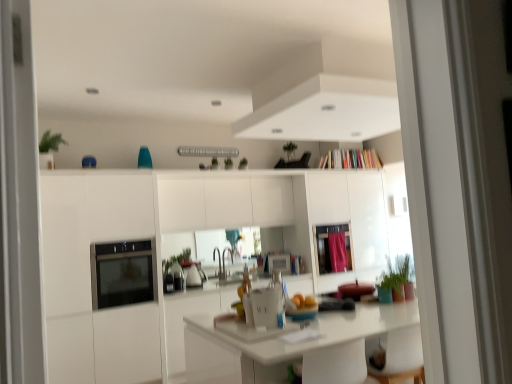
You are a GUI agent. You are given a task and a screenshot of the screen. Output one action in this format:
    pyautogui.click(x=<x>, y=<y>)
    Task: Click on the pink fabric screen door at center
    This screenshot has height=384, width=512.
    Given the screenshot: What is the action you would take?
    pyautogui.click(x=329, y=247)

This screenshot has width=512, height=384. What do you see at coordinates (337, 251) in the screenshot?
I see `pink fabric curtain at upper center` at bounding box center [337, 251].

At what (x,y) coordinates should I click in order to perform the action: click on pink fabric curtain at upper center. Please return your answer as a coordinate pair (x, y). The image size is (512, 384). Looking at the image, I should click on (337, 251).

In order to face green matte plant at lower right, placed as the 1th plant when sorted from front to back, should I rotate leftwards or rightwards?

To face it directly, rotate right by 19.188 degrees.

What do you see at coordinates (122, 273) in the screenshot? I see `black glass oven at lower left` at bounding box center [122, 273].

At what (x,y) coordinates should I click in order to perform the action: click on pink fabric screen door at center. Please return your answer as a coordinate pair (x, y). Looking at the image, I should click on (329, 247).

Considering the sizes of objects pink fabric curtain at upper center and pink fabric screen door at center in the image provided, who is taller, pink fabric curtain at upper center or pink fabric screen door at center?

pink fabric screen door at center.

Between pink fabric curtain at upper center and pink fabric screen door at center, which one has larger width?

Wider between the two is pink fabric screen door at center.

Which object is further away from the camera, pink fabric curtain at upper center or pink fabric screen door at center?

pink fabric curtain at upper center.

Does green matte plant at lower right, placed as the 1th plant when sorted from front to back, have a greater height compared to pink fabric screen door at center?

No, green matte plant at lower right, placed as the 1th plant when sorted from front to back, is not taller than pink fabric screen door at center.

Which is more to the left, green matte plant at lower right, which is the third plant in top-to-bottom order, or pink fabric screen door at center?

From the viewer's perspective, pink fabric screen door at center appears more on the left side.

Consider the image. From the image's perspective, which one is positioned higher, green matte plant at lower right, which ranks as the 3th plant in left-to-right order, or pink fabric screen door at center?

green matte plant at lower right, which ranks as the 3th plant in left-to-right order.

From the picture: Which is less distant, (x=412, y=288) or (x=346, y=260)?

Point (x=412, y=288) appears to be closer to the viewer than point (x=346, y=260).

Does white glossy microwave at center come behind pink fabric screen door at center?

Yes, white glossy microwave at center is further from the camera.

Does white glossy microwave at center turn towards pink fabric screen door at center?

No, white glossy microwave at center is not aimed at pink fabric screen door at center.

Is white glossy microwave at center to the left or to the right of pink fabric screen door at center in the image?

Based on their positions, white glossy microwave at center is located to the left of pink fabric screen door at center.

Looking at their sizes, would you say white glossy microwave at center is wider or thinner than pink fabric screen door at center?

Clearly, white glossy microwave at center has less width compared to pink fabric screen door at center.

Which object is thinner, white glossy microwave at center or black glass oven at lower left?

Thinner between the two is white glossy microwave at center.

Is white glossy microwave at center oriented away from black glass oven at lower left?

No, white glossy microwave at center is not facing away from black glass oven at lower left.

How much distance is there between white glossy microwave at center and black glass oven at lower left?

5.49 feet.

Does point (284, 263) come in front of point (152, 258)?

No, (284, 263) is behind (152, 258).

From the picture: Between pink fabric screen door at center and green matte plant at upper center, arranged as the 2th plant when viewed from the back, which one is positioned in front?

green matte plant at upper center, arranged as the 2th plant when viewed from the back, is closer to the camera.

Who is shorter, pink fabric screen door at center or green matte plant at upper center, which ranks as the 3th plant in right-to-left order?

With less height is green matte plant at upper center, which ranks as the 3th plant in right-to-left order.

From the image's perspective, would you say pink fabric screen door at center is shown under green matte plant at upper center, which is counted as the 2th plant, starting from the bottom?

Correct, pink fabric screen door at center appears lower than green matte plant at upper center, which is counted as the 2th plant, starting from the bottom, in the image.

Are pink fabric screen door at center and green matte plant at upper center, which ranks as the 3th plant in right-to-left order, making contact?

No, pink fabric screen door at center is not in contact with green matte plant at upper center, which ranks as the 3th plant in right-to-left order.

Consider the image. From the image's perspective, is green matte plant at upper center, the first plant from the left, below green matte plant at lower right, which is the third plant in top-to-bottom order?

No, from the image's perspective, green matte plant at upper center, the first plant from the left, is not beneath green matte plant at lower right, which is the third plant in top-to-bottom order.

Which of these two, green matte plant at upper center, arranged as the 2th plant when viewed from the back, or green matte plant at lower right, which ranks as the 3th plant in left-to-right order, is bigger?

green matte plant at lower right, which ranks as the 3th plant in left-to-right order.

From their relative heights in the image, would you say green matte plant at upper center, arranged as the second plant when viewed from the front, is taller or shorter than green matte plant at lower right, marked as the 1th plant in a bottom-to-top arrangement?

Considering their sizes, green matte plant at upper center, arranged as the second plant when viewed from the front, has less height than green matte plant at lower right, marked as the 1th plant in a bottom-to-top arrangement.

Which object is further away from the camera taking this photo, green matte plant at upper center, placed as the second plant when sorted from top to bottom, or green matte plant at lower right, which is the third plant in top-to-bottom order?

green matte plant at upper center, placed as the second plant when sorted from top to bottom, is further from the camera.

Is green matte plant at lower right, which ranks as the 3th plant in left-to-right order, further to the viewer compared to pink fabric curtain at upper center?

No.

Is pink fabric curtain at upper center a part of green matte plant at lower right, marked as the 1th plant in a bottom-to-top arrangement?

No, pink fabric curtain at upper center is not inside green matte plant at lower right, marked as the 1th plant in a bottom-to-top arrangement.

What's the angular difference between green matte plant at lower right, marked as the 1th plant in a bottom-to-top arrangement, and pink fabric curtain at upper center's facing directions?

88.7 degrees separate the facing orientations of green matte plant at lower right, marked as the 1th plant in a bottom-to-top arrangement, and pink fabric curtain at upper center.

Measure the distance from green matte plant at lower right, arranged as the 3th plant when viewed from the back, to pink fabric curtain at upper center.

green matte plant at lower right, arranged as the 3th plant when viewed from the back, and pink fabric curtain at upper center are 7.34 feet apart from each other.

Identify the location of curtain lying below the pink fabric screen door at center (from the image's perspective). This screenshot has width=512, height=384. (337, 251).

At what (x,y) coordinates should I click in order to perform the action: click on screen door that is above the green matte plant at lower right, which is the third plant in top-to-bottom order (from a real-world perspective). Please return your answer as a coordinate pair (x, y). Looking at the image, I should click on (329, 247).

Considering their positions, is green matte plant at upper center, arranged as the 2th plant when viewed from the back, positioned closer to green matte plant at upper center, the 1th plant from the top, than green matte plant at lower right, placed as the 1th plant when sorted from right to left?

Among the two, green matte plant at upper center, arranged as the 2th plant when viewed from the back, is located nearer to green matte plant at upper center, the 1th plant from the top.

Which object lies nearer to the anchor point green matte plant at lower right, marked as the 1th plant in a bottom-to-top arrangement, green matte plant at upper center, the 1th plant from the top, or white glossy microwave at center?

The object closer to green matte plant at lower right, marked as the 1th plant in a bottom-to-top arrangement, is white glossy microwave at center.

Based on their spatial positions, is green matte plant at upper center, the second plant positioned from the left, or green matte plant at lower right, which is the third plant in top-to-bottom order, further from pink fabric curtain at upper center?

green matte plant at lower right, which is the third plant in top-to-bottom order, is further to pink fabric curtain at upper center.

Based on their spatial positions, is green matte plant at upper center, the 1th plant positioned from the back, or pink fabric curtain at upper center further from black glass oven at lower left?

pink fabric curtain at upper center is positioned further to the anchor black glass oven at lower left.

Looking at the image, which one is located closer to green matte plant at upper center, the 1th plant from the top, pink fabric screen door at center or green matte plant at lower right, placed as the 1th plant when sorted from front to back?

pink fabric screen door at center lies closer to green matte plant at upper center, the 1th plant from the top, than the other object.

Based on their spatial positions, is green matte plant at lower right, placed as the 1th plant when sorted from right to left, or pink fabric screen door at center further from black glass oven at lower left?

pink fabric screen door at center is further to black glass oven at lower left.

In the scene shown: When comparing their distances from pink fabric curtain at upper center, does green matte plant at upper center, the first plant from the left, or pink fabric screen door at center seem closer?

pink fabric screen door at center is positioned closer to the anchor pink fabric curtain at upper center.

Looking at the image, which one is located further to green matte plant at upper center, the first plant from the left, white glossy microwave at center or black glass oven at lower left?

black glass oven at lower left is positioned further to the anchor green matte plant at upper center, the first plant from the left.

Find the location of a particular element. curtain between green matte plant at lower right, marked as the 1th plant in a bottom-to-top arrangement, and green matte plant at upper center, which ranks as the 3th plant in bottom-to-top order, along the z-axis is located at coordinates (337, 251).

Image resolution: width=512 pixels, height=384 pixels. I want to click on appliance between black glass oven at lower left and pink fabric curtain at upper center, so click(x=279, y=263).

The width and height of the screenshot is (512, 384). Find the location of `screen door between green matte plant at upper center, arranged as the second plant when viewed from the front, and white glossy microwave at center, in the vertical direction`. screen door between green matte plant at upper center, arranged as the second plant when viewed from the front, and white glossy microwave at center, in the vertical direction is located at coordinates (329, 247).

The image size is (512, 384). Identify the location of plant between green matte plant at lower right, which is the third plant in top-to-bottom order, and pink fabric curtain at upper center in the front-back direction. (243, 164).